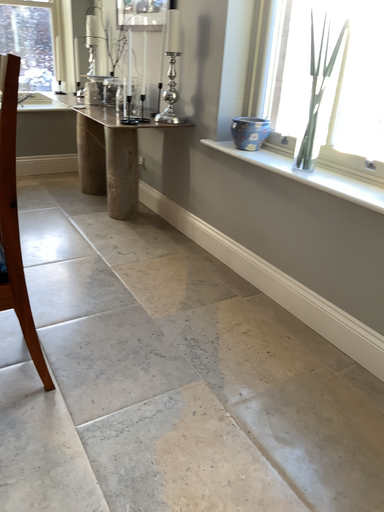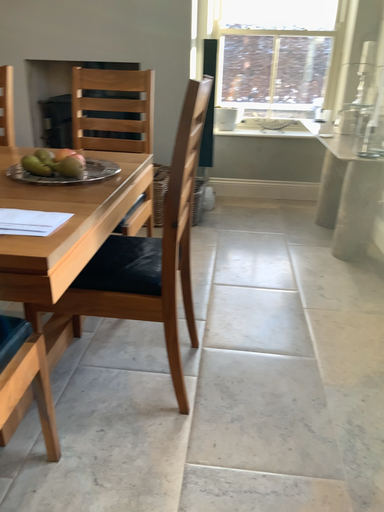
Question: How did the camera likely rotate when shooting the video?

Choices:
 (A) rotated left
 (B) rotated right

Answer: (A)